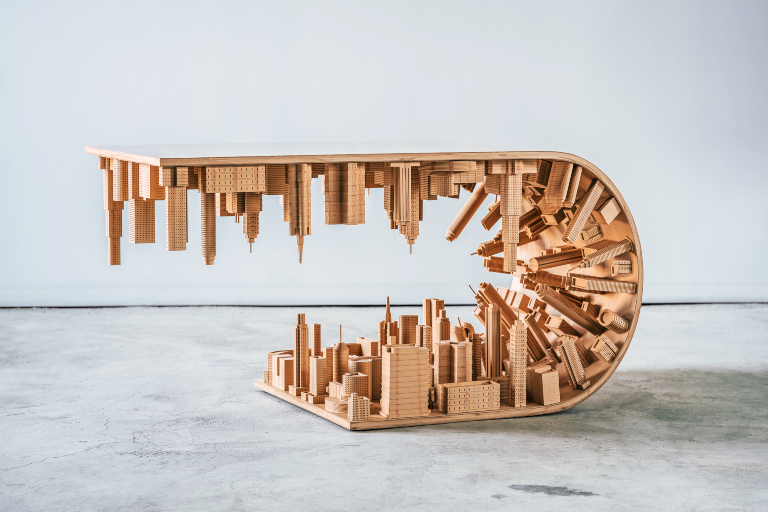
Where is `wall`? The image size is (768, 512). wall is located at coordinates (667, 148).